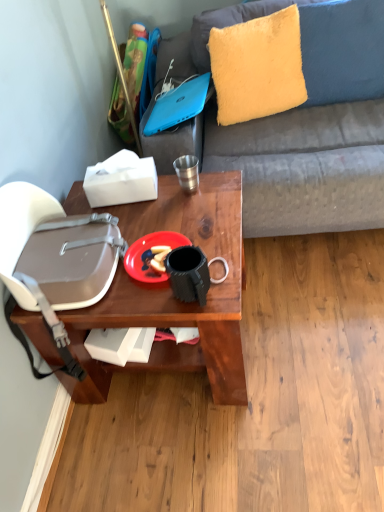
This screenshot has width=384, height=512. Find the location of `vacant space to the right of metallic silver cup at center`. vacant space to the right of metallic silver cup at center is located at coordinates (219, 182).